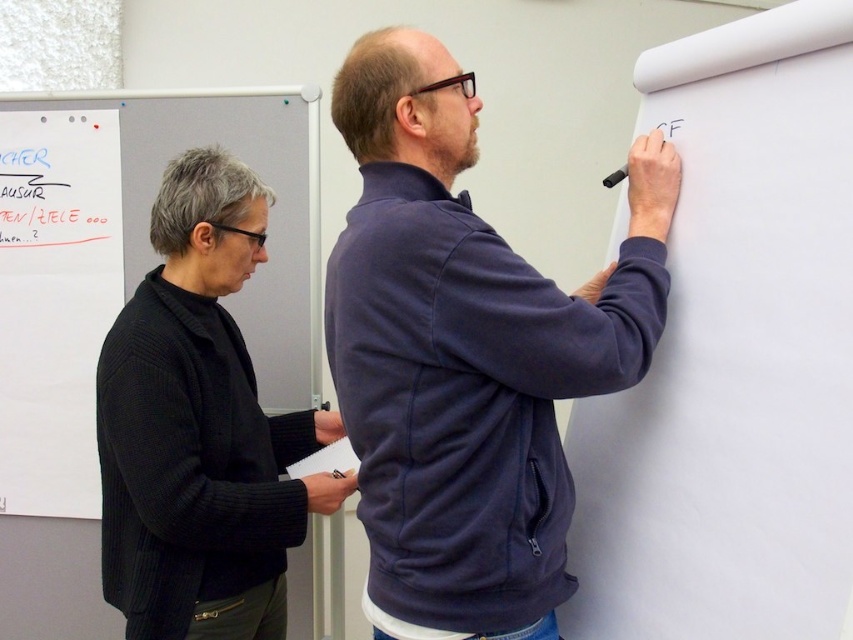
You are standing in front of the whiteboard and see two points marked on it. The first point is at coordinates point (270,312) and the second is at point (279,467). Which point is closer to you?

Point (270,312) is further to the viewer than point (279,467), so the second point is closer to you.